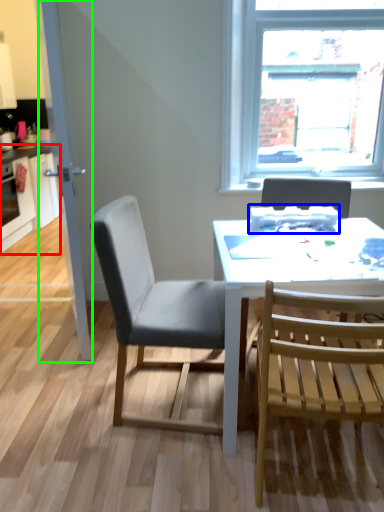
Question: Based on their relative distances, which object is nearer to cabinetry (highlighted by a red box)? Choose from appliance (highlighted by a blue box) and glass door (highlighted by a green box).

Choices:
 (A) appliance
 (B) glass door

Answer: (B)